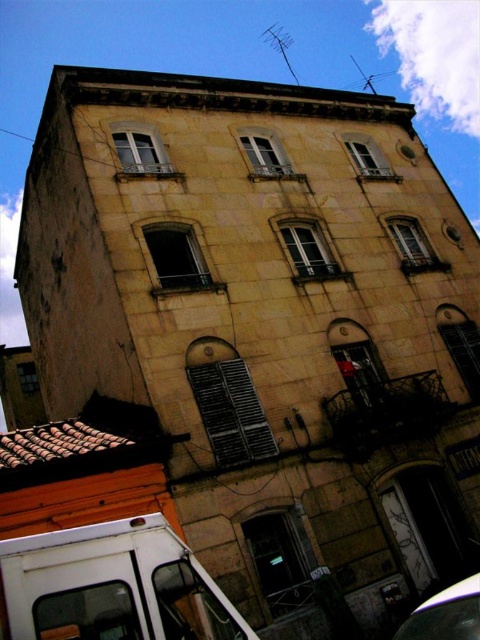
You are standing in front of the multi story building and want to park your white matte van at lower left. Is there enough space to park it near the building?

The white matte van at lower left is located at point (112, 586), which indicates its position relative to the building. However, without knowing the dimensions of the parking area or the van, it is impossible to determine if there is enough space to park it near the building. Please provide more information about the parking space dimensions.

You are a delivery driver who needs to park your vehicle between two buildings. The white matte van at lower left and the shiny silver car at lower right are already parked there. Which vehicle has more space between it and the building to allow easier access for unloading?

The shiny silver car at lower right has more space between it and the building because it is wider than the white matte van at lower left, providing more room for unloading.